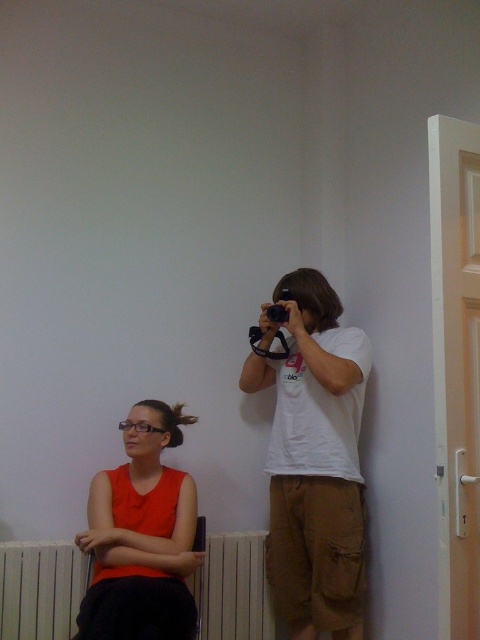
This screenshot has width=480, height=640. I want to click on matte orange top at lower left, so click(x=142, y=536).

Measure the distance between matte orange top at lower left and camera.

matte orange top at lower left is 1.90 meters from camera.

This screenshot has width=480, height=640. In order to click on matte orange top at lower left in this screenshot , I will do `click(142, 536)`.

Which is below, matte orange top at lower left or white metallic radiator at lower left?

white metallic radiator at lower left is lower down.

This screenshot has width=480, height=640. I want to click on matte orange top at lower left, so click(142, 536).

Which is behind, point (197, 561) or point (240, 541)?

Point (240, 541)

At what (x,y) coordinates should I click in order to perform the action: click on matte orange top at lower left. Please return your answer as a coordinate pair (x, y). Looking at the image, I should click on pos(142,536).

Does white metallic radiator at lower left have a larger size compared to black plastic camera at upper center?

Yes.

Who is shorter, white metallic radiator at lower left or black plastic camera at upper center?

black plastic camera at upper center is shorter.

Which is behind, point (247, 544) or point (276, 310)?

The point (247, 544) is more distant.

Find the location of `white metallic radiator at lower left`. white metallic radiator at lower left is located at coordinates (39, 589).